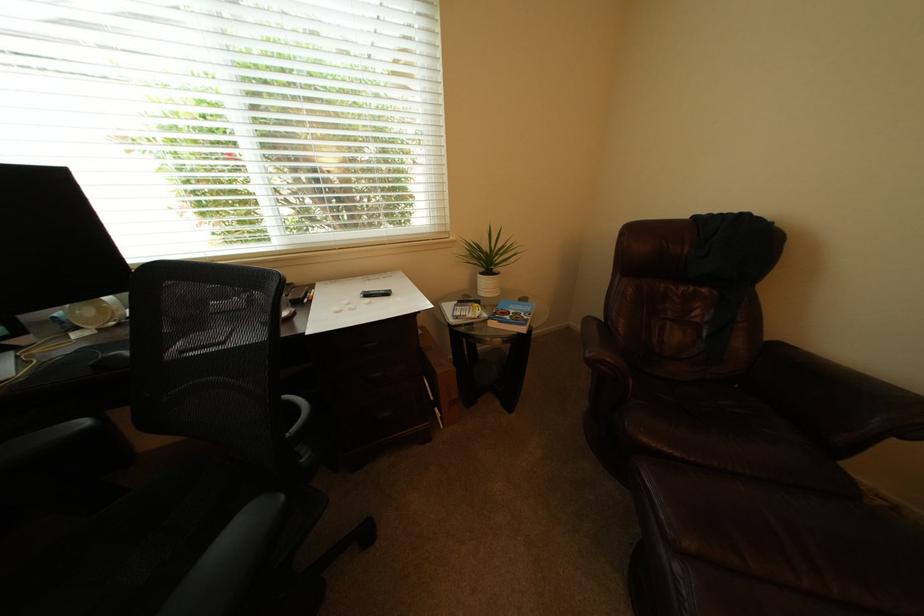
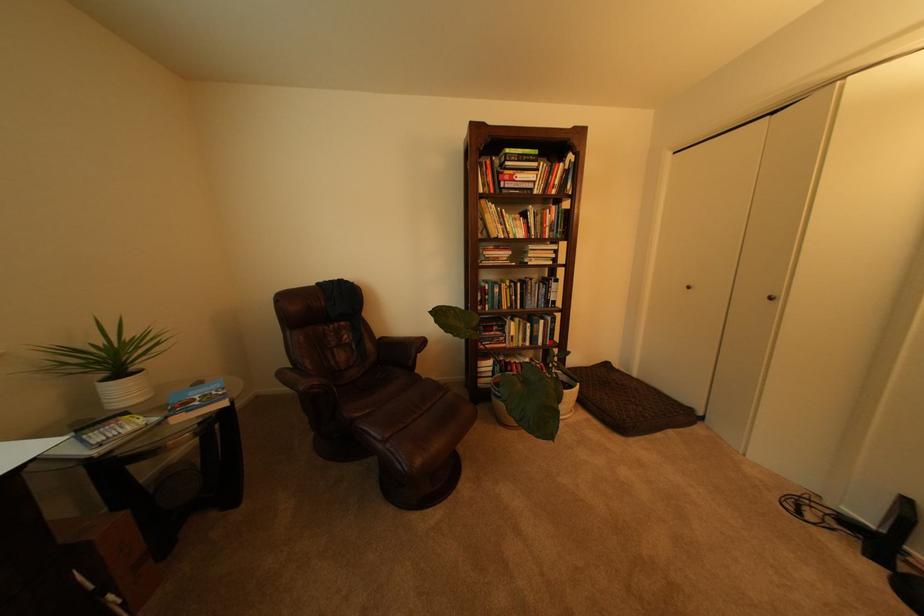
The point at (x=482, y=309) is marked in the first image. Where is the corresponding point in the second image?

(130, 424)